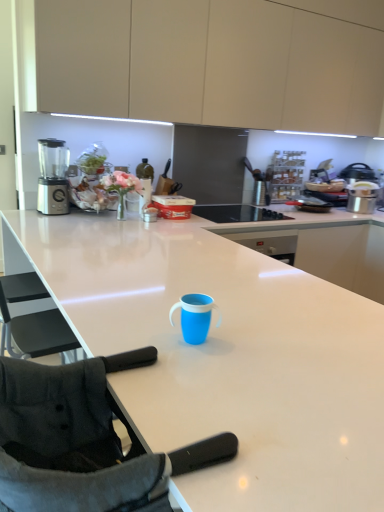
This screenshot has width=384, height=512. In order to click on free space to the right of satin silver blender at left in this screenshot , I will do `click(68, 214)`.